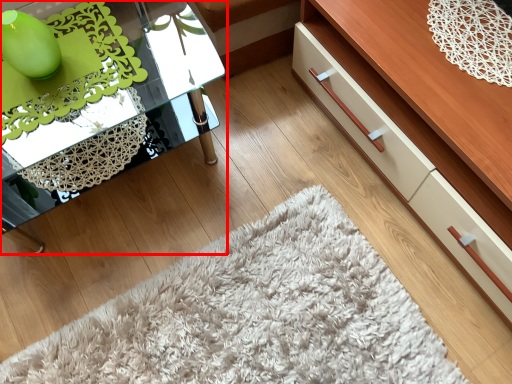
Question: Observing the image, what is the correct spatial positioning of table (annotated by the red box) in reference to dresser?

Choices:
 (A) left
 (B) right

Answer: (A)